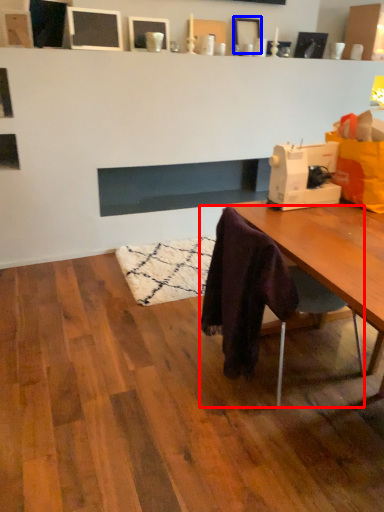
Question: Which object appears farthest to the camera in this image, chair (highlighted by a red box) or picture frame (highlighted by a blue box)?

Choices:
 (A) chair
 (B) picture frame

Answer: (B)